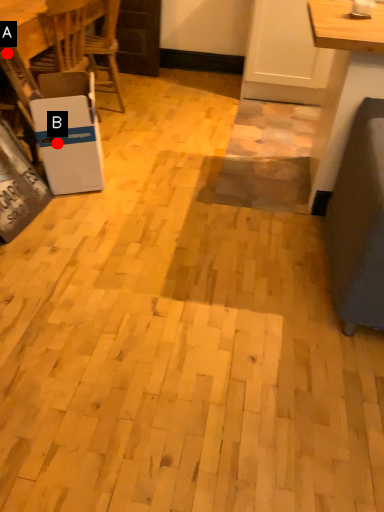
Question: Two points are circled on the image, labeled by A and B beside each circle. Which of the following is the farthest from the observer?

Choices:
 (A) A is further
 (B) B is further

Answer: (A)